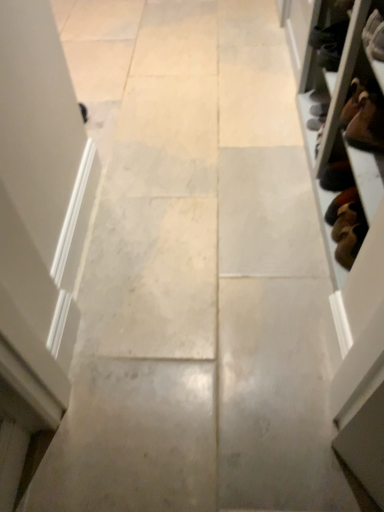
Locate an element on the screen. The height and width of the screenshot is (512, 384). brown suede shoe at right is located at coordinates (341, 204).

What do you see at coordinates (341, 204) in the screenshot?
I see `brown suede shoe at right` at bounding box center [341, 204].

Where is `brown suede shoe at right`? This screenshot has width=384, height=512. brown suede shoe at right is located at coordinates (341, 204).